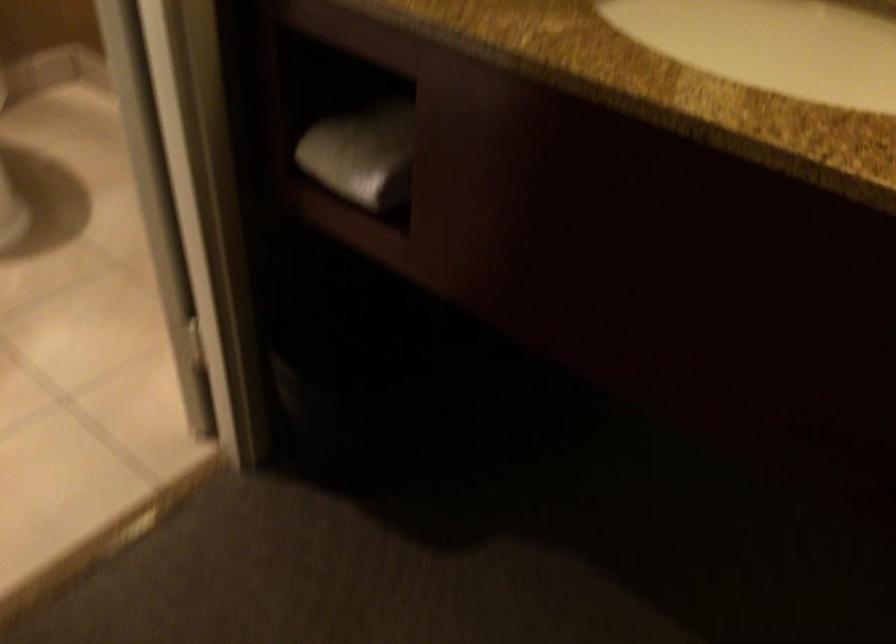
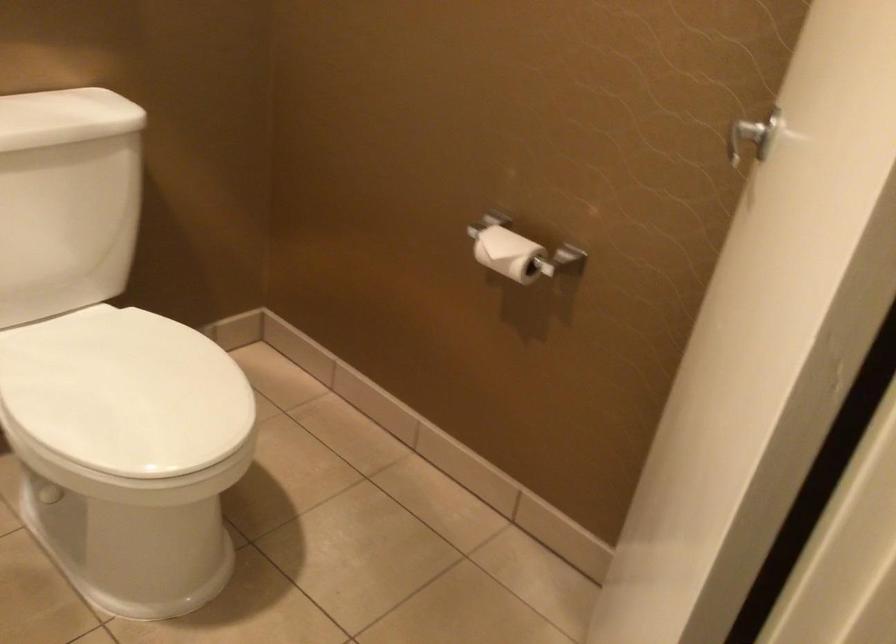
Question: The first image is from the beginning of the video and the second image is from the end. How did the camera likely rotate when shooting the video?

Choices:
 (A) Left
 (B) Right
 (C) Up
 (D) Down

Answer: (C)